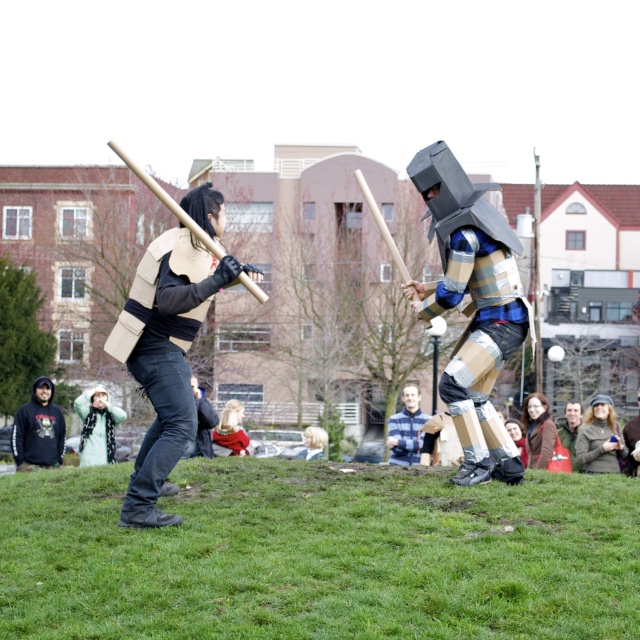
Describe the element at coordinates (321, 554) in the screenshot. This screenshot has height=640, width=640. I see `green grass at lower center` at that location.

Can you confirm if green grass at lower center is positioned to the left of matte cardboard vest at left?

Incorrect, green grass at lower center is not on the left side of matte cardboard vest at left.

Which is in front, point (577, 499) or point (168, 333)?

Positioned in front is point (168, 333).

Locate an element on the screen. The height and width of the screenshot is (640, 640). green grass at lower center is located at coordinates (321, 554).

Is point (32, 451) closer to viewer compared to point (416, 410)?

Yes.

Does dark gray hoodie at lower left have a lesser height compared to blue plaid shirt at center?

Yes, dark gray hoodie at lower left is shorter than blue plaid shirt at center.

Who is more distant from viewer, (38, 456) or (401, 454)?

Point (401, 454)

The image size is (640, 640). I want to click on dark gray hoodie at lower left, so click(x=38, y=429).

Does green wool scarf at lower left have a larger size compared to blue plaid shirt at center?

No, green wool scarf at lower left is not bigger than blue plaid shirt at center.

Who is shorter, green wool scarf at lower left or blue plaid shirt at center?

green wool scarf at lower left is shorter.

Is point (83, 445) positioned behind point (397, 452)?

Yes, point (83, 445) is behind point (397, 452).

The image size is (640, 640). I want to click on green wool scarf at lower left, so click(97, 426).